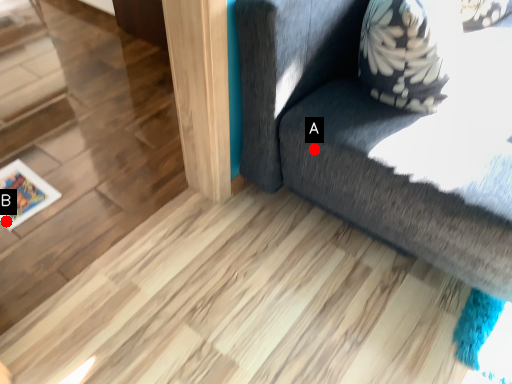
Question: Two points are circled on the image, labeled by A and B beside each circle. Which point is closer to the camera?

Choices:
 (A) A is closer
 (B) B is closer

Answer: (A)